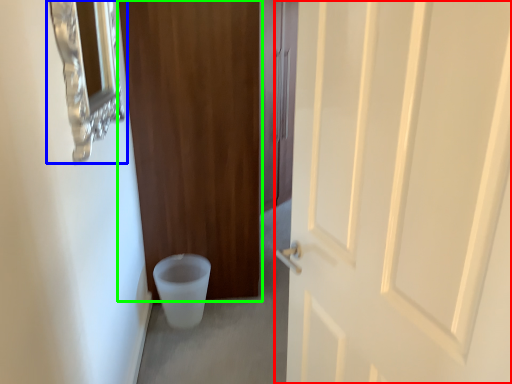
Question: Considering the real-world distances, which object is farthest from door (highlighted by a red box)? medicine cabinet (highlighted by a blue box) or door (highlighted by a green box)?

Choices:
 (A) medicine cabinet
 (B) door

Answer: (B)